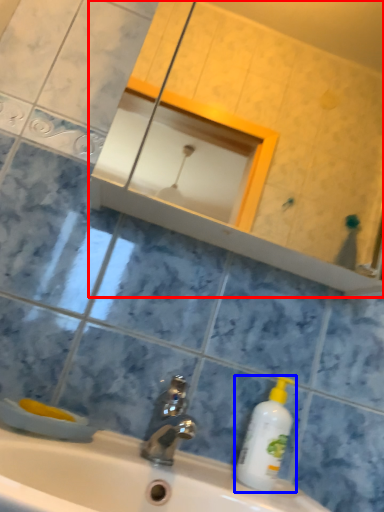
Question: Which point is closer to the camera, mirror (highlighted by a red box) or cleaning product (highlighted by a blue box)?

Choices:
 (A) mirror
 (B) cleaning product

Answer: (A)